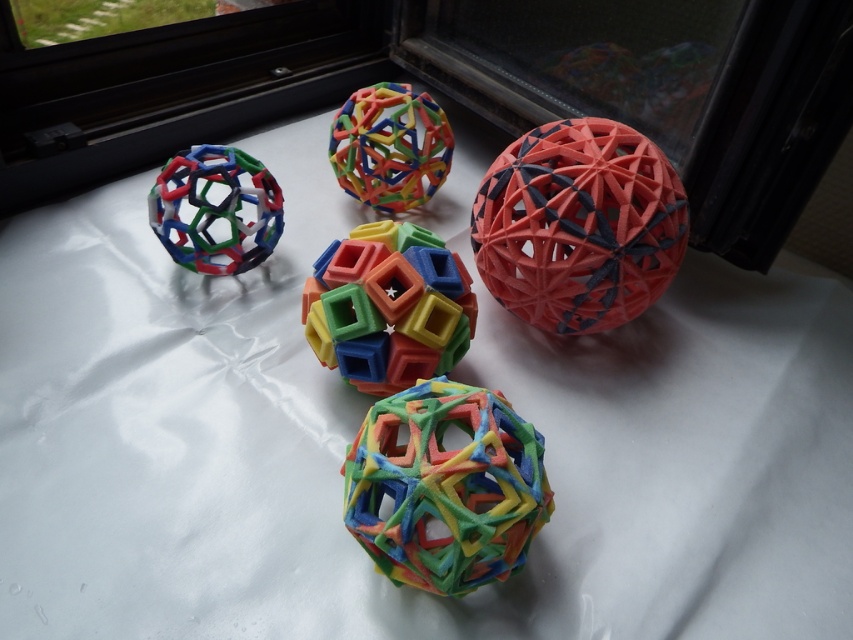
Question: Which point is closer to the camera taking this photo?

Choices:
 (A) (415, 102)
 (B) (547, 172)

Answer: (B)

Question: Which point is closer to the camera taking this photo?

Choices:
 (A) (463, 540)
 (B) (195, 234)
 (C) (598, 268)

Answer: (A)

Question: Does multicolored rubber ball at center lie behind multicolored plastic ball at left?

Choices:
 (A) yes
 (B) no

Answer: (B)

Question: Which object is closer to the camera taking this photo?

Choices:
 (A) matte plastic ball at center
 (B) multicolored rubber ball at center
 (C) multicolored plastic ball at left

Answer: (B)

Question: Where is matte plastic ball at center located in relation to multicolored plastic cube at center in the image?

Choices:
 (A) left
 (B) right

Answer: (B)

Question: Does matte plastic ball at center have a greater width compared to multicolored plastic ball at center?

Choices:
 (A) yes
 (B) no

Answer: (A)